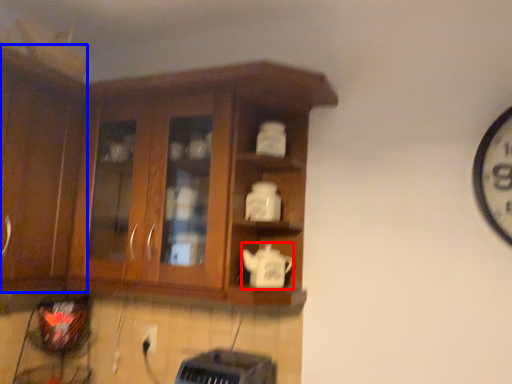
Question: Among these objects, which one is farthest to the camera, teapot (highlighted by a red box) or cabinetry (highlighted by a blue box)?

Choices:
 (A) teapot
 (B) cabinetry

Answer: (A)